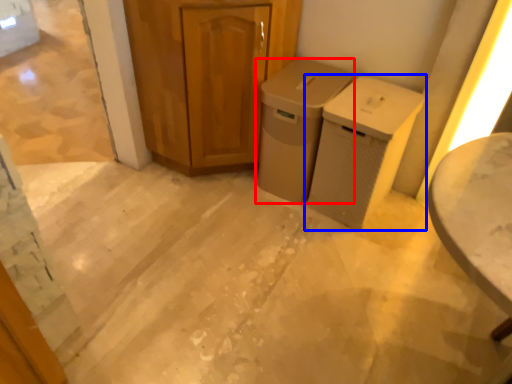
Question: Which object appears closest to the camera in this image, waste container (highlighted by a red box) or waste container (highlighted by a blue box)?

Choices:
 (A) waste container
 (B) waste container

Answer: (B)